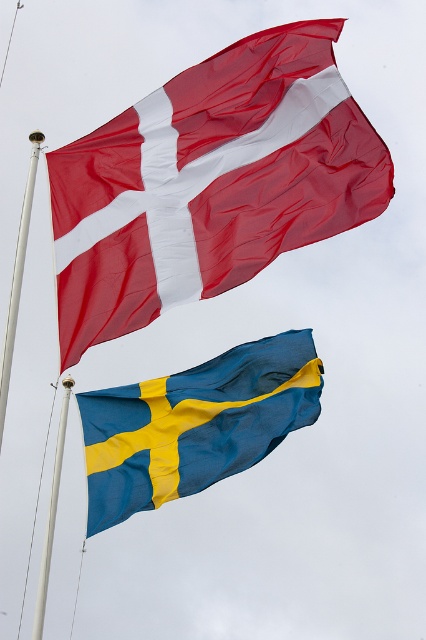
Question: Is blue/yellow fabric flag at lower center to the left of white metallic pole at upper left from the viewer's perspective?

Choices:
 (A) yes
 (B) no

Answer: (B)

Question: Considering the real-world distances, which object is farthest from the blue/yellow fabric flag at lower center?

Choices:
 (A) matte red flag at upper center
 (B) white metallic pole at center
 (C) white metallic pole at upper left

Answer: (A)

Question: Is matte red flag at upper center smaller than white metallic pole at center?

Choices:
 (A) no
 (B) yes

Answer: (B)

Question: Among these objects, which one is nearest to the camera?

Choices:
 (A) matte red flag at upper center
 (B) white metallic pole at upper left

Answer: (B)

Question: Which object appears closest to the camera in this image?

Choices:
 (A) white metallic pole at upper left
 (B) matte red flag at upper center
 (C) white metallic pole at center
 (D) blue/yellow fabric flag at lower center

Answer: (A)

Question: Can you confirm if blue/yellow fabric flag at lower center is smaller than white metallic pole at center?

Choices:
 (A) no
 (B) yes

Answer: (B)